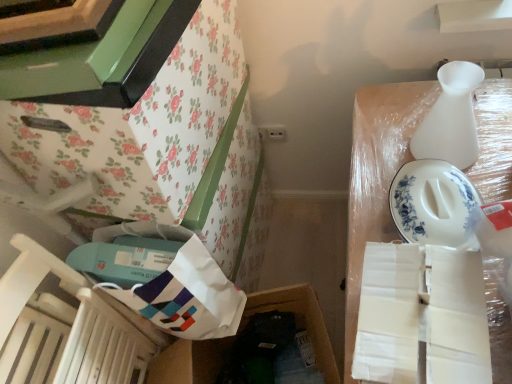
Identify the location of vacant space behind white matte vase at upper right. This screenshot has width=512, height=384. (395, 109).